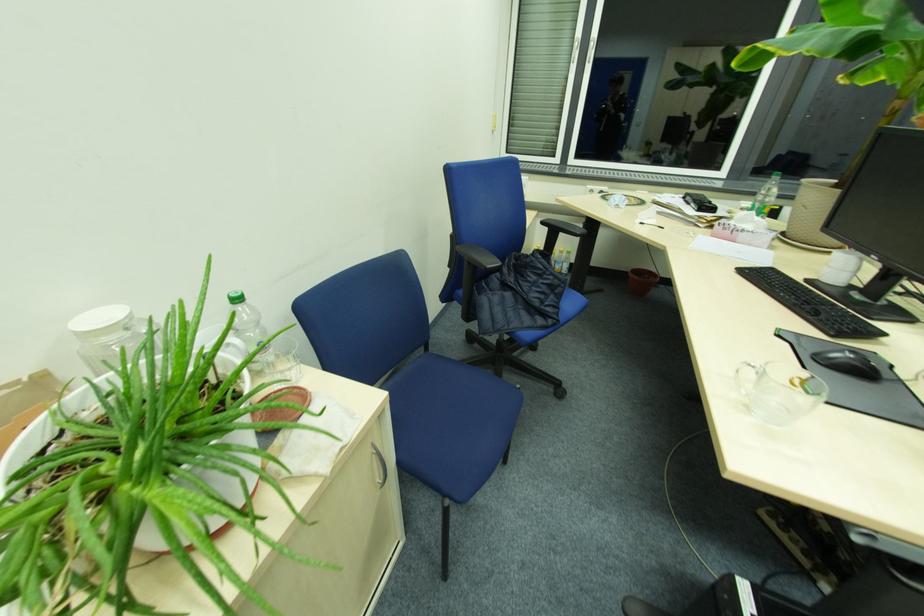
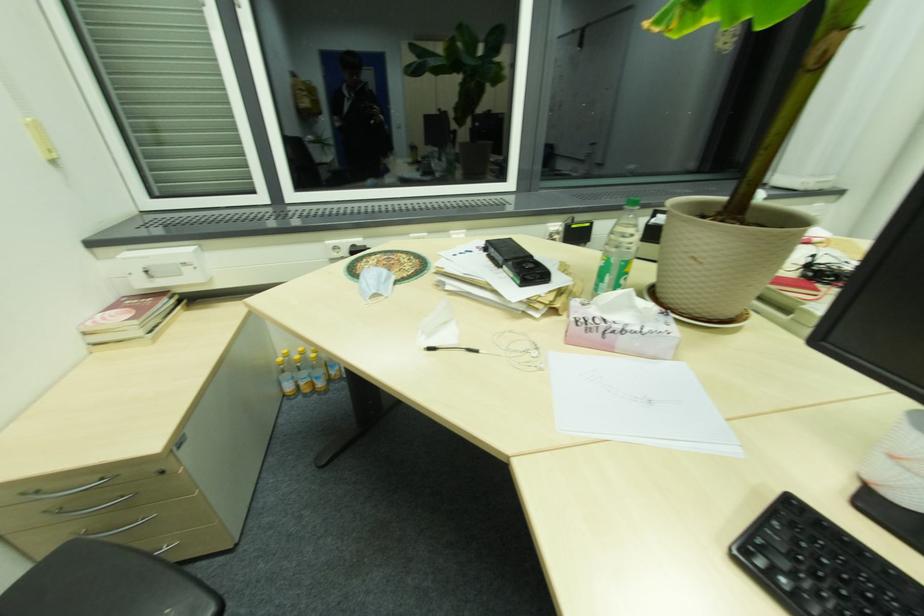
In the second image, find the point that corresponds to pixel 631 204 in the first image.

(397, 280)